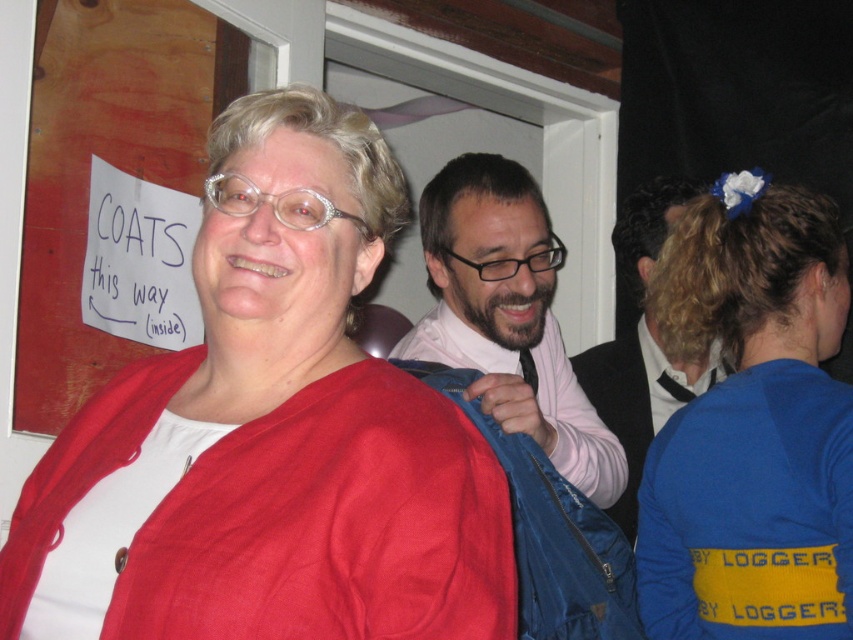
Question: Among these points, which one is farthest from the camera?

Choices:
 (A) (531, 387)
 (B) (55, 440)

Answer: (A)

Question: Which object is positioned farthest from the blue jersey at upper right?

Choices:
 (A) matte blue jacket at center
 (B) black silk tie at center
 (C) matte black suit at center

Answer: (C)

Question: Is matte red sweater at center positioned in front of blue jersey at upper right?

Choices:
 (A) yes
 (B) no

Answer: (A)

Question: Which object is positioned closest to the matte red sweater at center?

Choices:
 (A) blue jersey at upper right
 (B) matte black suit at center

Answer: (A)

Question: Can you confirm if blue jersey at upper right is positioned to the left of matte blue jacket at center?

Choices:
 (A) no
 (B) yes

Answer: (A)

Question: Is blue jersey at upper right behind matte blue jacket at center?

Choices:
 (A) yes
 (B) no

Answer: (B)